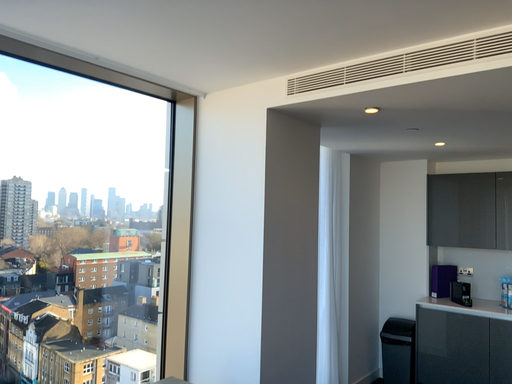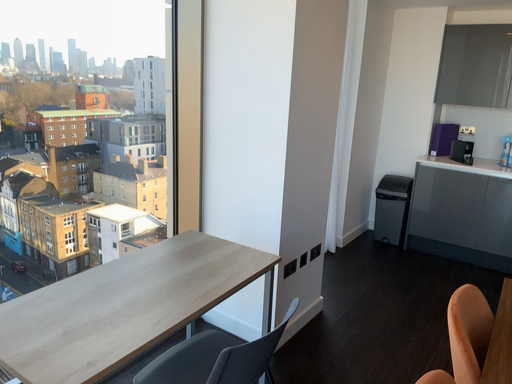
Question: How did the camera likely rotate when shooting the video?

Choices:
 (A) rotated downward
 (B) rotated upward

Answer: (A)